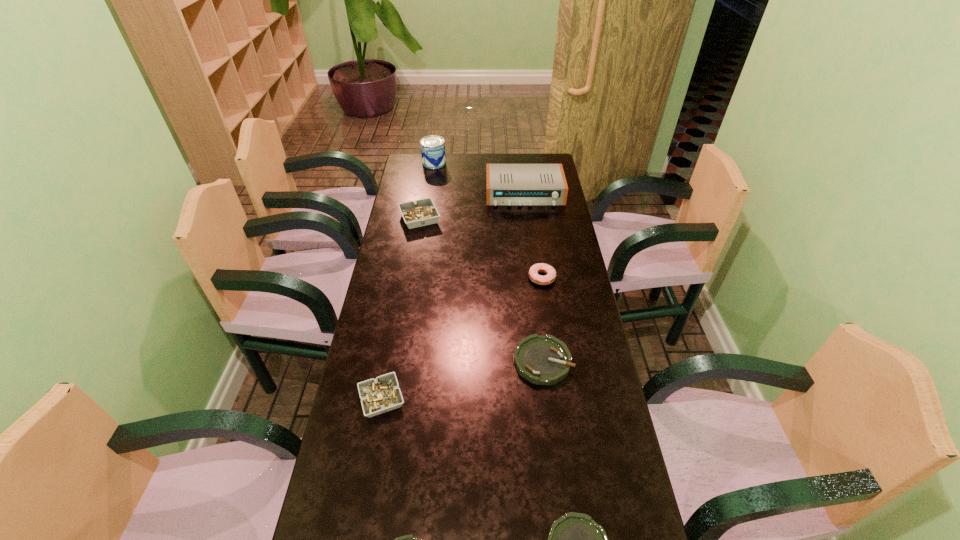
Where is `blank space located 0.400m on the control panel of the second tallest object`? blank space located 0.400m on the control panel of the second tallest object is located at coordinates (535, 272).

Where is `blank area located 0.330m on the front of the sixth shortest object`? This screenshot has height=540, width=960. blank area located 0.330m on the front of the sixth shortest object is located at coordinates (408, 291).

The width and height of the screenshot is (960, 540). What are the coordinates of `free region located on the left of the pink doughnut` in the screenshot? It's located at (447, 278).

Locate an element on the screen. This screenshot has height=540, width=960. vacant space located on the back of the nearer gray ashtray is located at coordinates (398, 306).

Image resolution: width=960 pixels, height=540 pixels. Find the location of `free space located 0.250m on the left of the biggest green ashtray`. free space located 0.250m on the left of the biggest green ashtray is located at coordinates (430, 361).

This screenshot has width=960, height=540. Find the location of `object that is at the far edge`. object that is at the far edge is located at coordinates (433, 155).

I want to click on can that is at the left edge, so click(x=433, y=155).

Where is `radio receiver that is at the right edge`? The image size is (960, 540). radio receiver that is at the right edge is located at coordinates (506, 184).

I want to click on doughnut situated at the right edge, so click(x=540, y=267).

You are a GUI agent. You are given a task and a screenshot of the screen. Output one action in this format:
    pyautogui.click(x=<x>, y=<y>)
    Task: Click on the ashtray at the right edge
    The height and width of the screenshot is (540, 960).
    Given the screenshot: What is the action you would take?
    pyautogui.click(x=542, y=360)